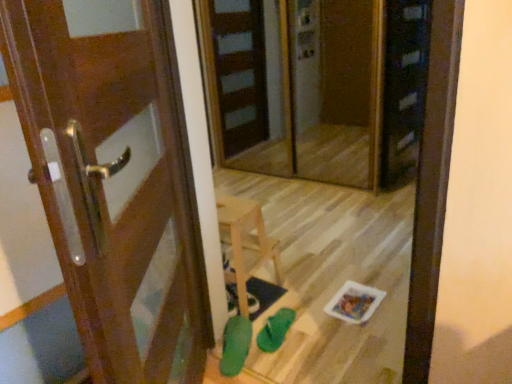
Where is `vacant space underneath green rubber shoe at lower center, which is the 1th shoe from right to left (from a real-world perspective)`? This screenshot has width=512, height=384. vacant space underneath green rubber shoe at lower center, which is the 1th shoe from right to left (from a real-world perspective) is located at coordinates (279, 326).